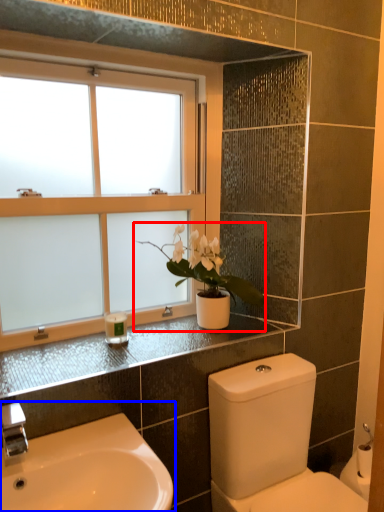
Question: Which object appears farthest to the camera in this image, houseplant (highlighted by a red box) or sink (highlighted by a blue box)?

Choices:
 (A) houseplant
 (B) sink

Answer: (A)